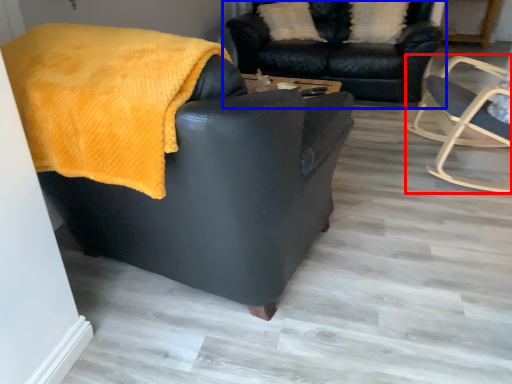
Question: Which point is further to the camera, chair (highlighted by a red box) or studio couch (highlighted by a blue box)?

Choices:
 (A) chair
 (B) studio couch

Answer: (B)